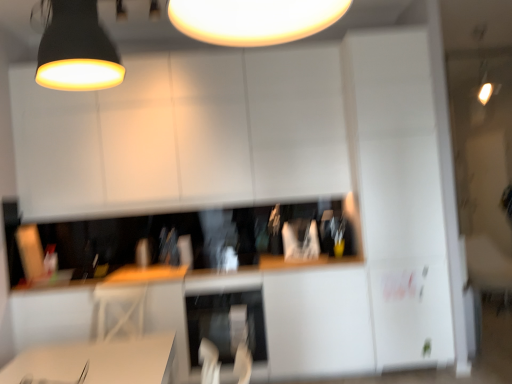
Question: Is matte black lampshade at upper left, the 1th lamp positioned from the left, aimed at satin silver dishwasher at center?

Choices:
 (A) no
 (B) yes

Answer: (A)

Question: Is matte black lampshade at upper left, which is counted as the 1th lamp, starting from the front, oriented away from satin silver dishwasher at center?

Choices:
 (A) yes
 (B) no

Answer: (B)

Question: Is matte black lampshade at upper left, marked as the second lamp in a back-to-front arrangement, to the right of satin silver dishwasher at center from the viewer's perspective?

Choices:
 (A) yes
 (B) no

Answer: (B)

Question: Can we say matte black lampshade at upper left, which appears as the 2th lamp when viewed from the top, lies outside satin silver dishwasher at center?

Choices:
 (A) no
 (B) yes

Answer: (B)

Question: Considering the relative sizes of matte black lampshade at upper left, which is the 1th lamp in bottom-to-top order, and satin silver dishwasher at center in the image provided, is matte black lampshade at upper left, which is the 1th lamp in bottom-to-top order, thinner than satin silver dishwasher at center?

Choices:
 (A) no
 (B) yes

Answer: (B)

Question: Is point (71, 66) positioned closer to the camera than point (50, 71)?

Choices:
 (A) farther
 (B) closer

Answer: (B)

Question: In the image, is matte black lampshade at upper left, the second lamp when ordered from right to left, positioned in front of or behind matte black lampshade at upper center, acting as the second lamp starting from the bottom?

Choices:
 (A) front
 (B) behind

Answer: (A)

Question: In terms of height, does matte black lampshade at upper left, which is counted as the 1th lamp, starting from the front, look taller or shorter compared to matte black lampshade at upper center, arranged as the 2th lamp when viewed from the front?

Choices:
 (A) short
 (B) tall

Answer: (B)

Question: Considering the positions of matte black lampshade at upper left, which is the 1th lamp in bottom-to-top order, and matte black lampshade at upper center, which is counted as the first lamp, starting from the right, in the image, is matte black lampshade at upper left, which is the 1th lamp in bottom-to-top order, bigger or smaller than matte black lampshade at upper center, which is counted as the first lamp, starting from the right,?

Choices:
 (A) small
 (B) big

Answer: (A)

Question: From the image's perspective, is white glossy computer desk at lower center positioned above or below matte black lampshade at upper left, the 1th lamp positioned from the left?

Choices:
 (A) above
 (B) below

Answer: (B)

Question: Looking at the image, does white glossy computer desk at lower center seem bigger or smaller compared to matte black lampshade at upper left, the 1th lamp positioned from the left?

Choices:
 (A) big
 (B) small

Answer: (A)

Question: Is white glossy computer desk at lower center in front of or behind matte black lampshade at upper left, which appears as the 2th lamp when viewed from the top, in the image?

Choices:
 (A) behind
 (B) front

Answer: (A)

Question: Is white glossy computer desk at lower center taller or shorter than matte black lampshade at upper left, the 1th lamp positioned from the left?

Choices:
 (A) tall
 (B) short

Answer: (B)

Question: From a real-world perspective, is matte black lampshade at upper center, acting as the second lamp starting from the bottom, physically located above or below matte black lampshade at upper left, which is counted as the 1th lamp, starting from the front?

Choices:
 (A) below
 (B) above

Answer: (B)

Question: Considering the positions of point (117, 16) and point (68, 87), is point (117, 16) closer or farther from the camera than point (68, 87)?

Choices:
 (A) farther
 (B) closer

Answer: (A)